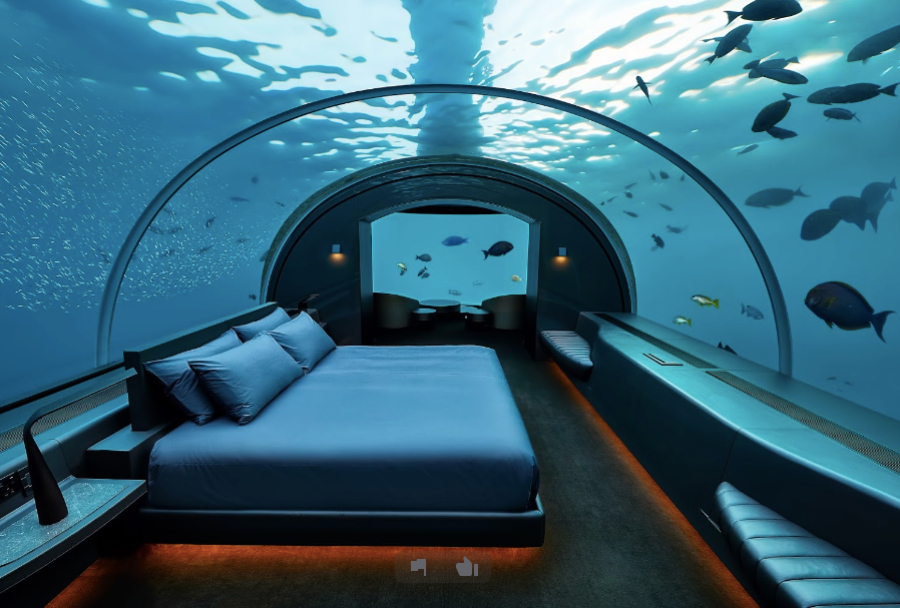
Where is `side table`? This screenshot has height=608, width=900. side table is located at coordinates (55, 539).